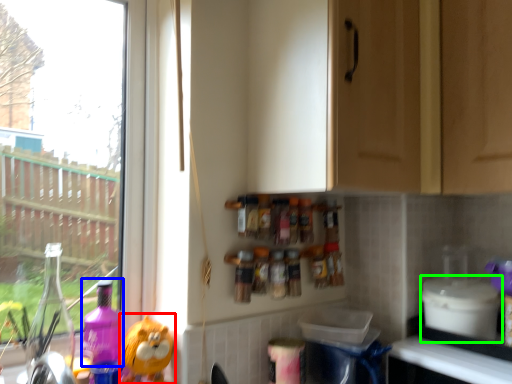
Question: Which is farther away from toy (highlighted by a red box)? cleaning product (highlighted by a blue box) or appliance (highlighted by a green box)?

Choices:
 (A) cleaning product
 (B) appliance

Answer: (B)